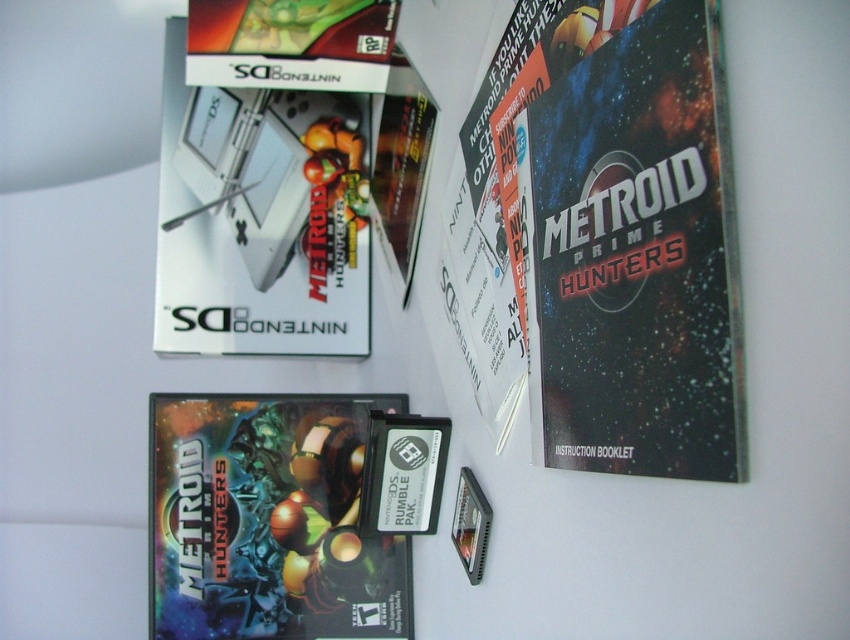
Which is behind, point (683, 333) or point (204, 285)?

Point (204, 285)

This screenshot has width=850, height=640. Find the location of `metallic silver instruction booklet at upper right`. metallic silver instruction booklet at upper right is located at coordinates click(636, 256).